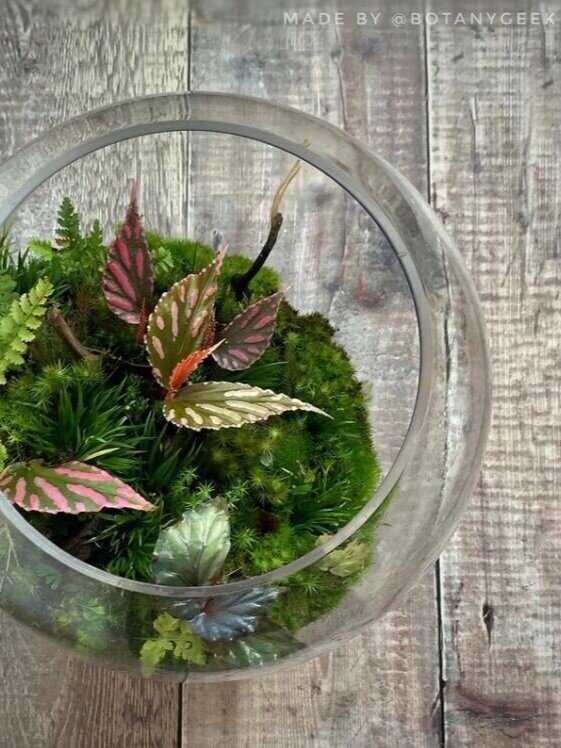
The image size is (561, 748). I want to click on knot in wood, so click(x=486, y=622).